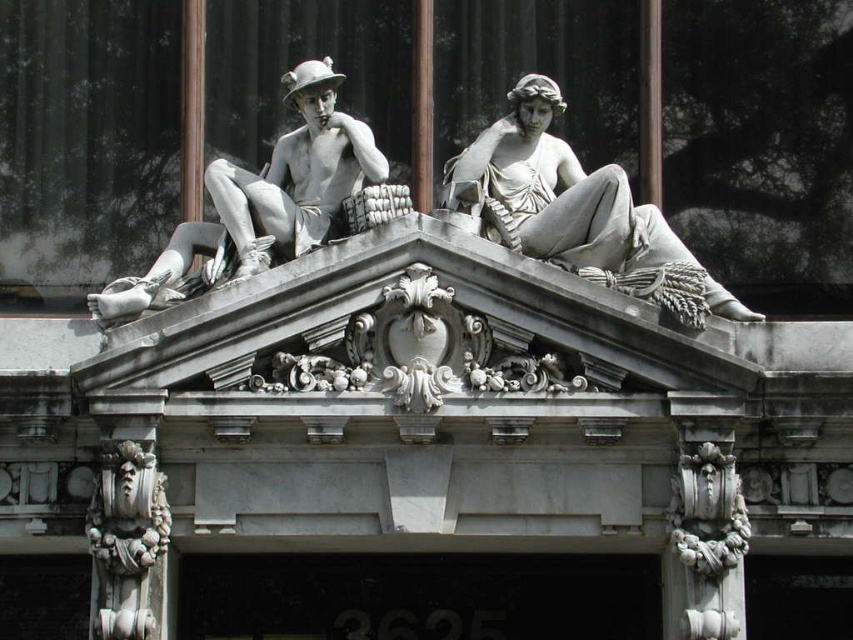
You are an architect examining the classical facade. You notice a matte stone statue located at coordinates point (x=263, y=198). Based on its position, which part of the architectural structure does this statue belong to?

The matte stone statue at point (x=263, y=198) is part of the triangular pediment, as it is positioned at the upper left corner of the structure.

Looking at this image, you are an art conservator assessing the structural integrity of the classical facade. You notice the white marble statue at upper right and the white stone decorative element at lower left. Given their sizes, which one might require more reinforcement to prevent damage from wind pressure?

The white marble statue at upper right requires more reinforcement because its width is larger than the white stone decorative element at lower left, making it more susceptible to wind pressure.

You are an architect designing a new building and want to place a new decorative element on the facade. The existing structure has a white marble statue at upper right located at coordinates 0.331, 0.682. Where should you place the new element to maintain symmetry with the statue?

To maintain symmetry with the white marble statue at upper right located at coordinates (581, 211), the new element should be placed at coordinates (581, 428).